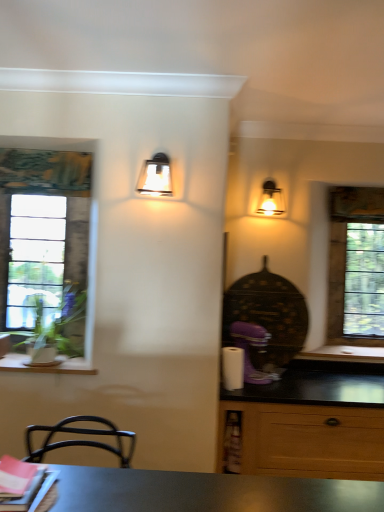
Question: Relative to metallic glass sconce at upper center, marked as the first lamp in a left-to-right arrangement, is matte glass sconce at upper right, the first lamp viewed from the back, in front or behind?

Choices:
 (A) front
 (B) behind

Answer: (B)

Question: From the image's perspective, is matte glass sconce at upper right, the second lamp in the front-to-back sequence, located above or below metallic glass sconce at upper center, marked as the first lamp in a left-to-right arrangement?

Choices:
 (A) above
 (B) below

Answer: (B)

Question: Estimate the real-world distances between objects in this image. Which object is farther from the metallic glass sconce at upper center, acting as the second lamp starting from the right?

Choices:
 (A) matte glass sconce at upper right, the first lamp viewed from the back
 (B) clear glass window at left, the 2th window when ordered from right to left
 (C) clear glass window at right, which ranks as the 1th window in back-to-front order
 (D) wooden at left

Answer: (C)

Question: Which object is the farthest from the metallic glass sconce at upper center, which appears as the first lamp when viewed from the front?

Choices:
 (A) clear glass window at left, marked as the first window in a left-to-right arrangement
 (B) clear glass window at right, which ranks as the 1th window in back-to-front order
 (C) wooden at left
 (D) matte glass sconce at upper right, which appears as the 2th lamp when viewed from the left

Answer: (B)